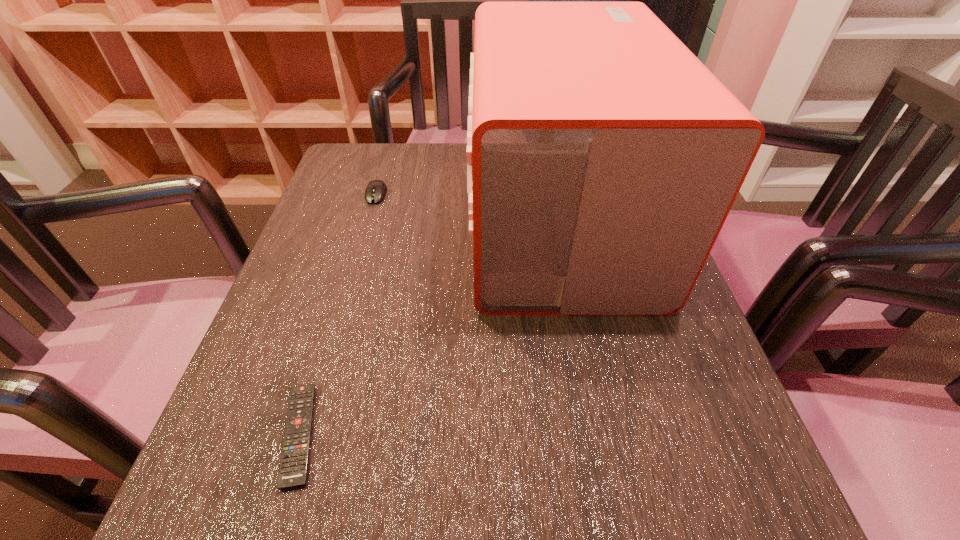
The height and width of the screenshot is (540, 960). I want to click on box that is at the far edge, so pos(603,157).

Locate an element on the screen. computer mouse present at the far edge is located at coordinates (376, 190).

Find the location of a particular element. object present at the near edge is located at coordinates (293, 467).

Image resolution: width=960 pixels, height=540 pixels. I want to click on computer mouse present at the left edge, so click(376, 190).

At what (x,y) coordinates should I click in order to perform the action: click on remote control situated at the left edge. Please return your answer as a coordinate pair (x, y). Looking at the image, I should click on (293, 467).

Identify the location of object that is at the right edge. (603, 157).

The height and width of the screenshot is (540, 960). I want to click on object located at the far left corner, so click(x=376, y=190).

You are a GUI agent. You are given a task and a screenshot of the screen. Output one action in this format:
    pyautogui.click(x=<x>, y=<y>)
    Task: Click on the object that is at the near left corner
    The image size is (960, 540).
    Given the screenshot: What is the action you would take?
    pyautogui.click(x=293, y=467)

The height and width of the screenshot is (540, 960). Find the location of `object positioned at the far right corner`. object positioned at the far right corner is located at coordinates (603, 157).

This screenshot has width=960, height=540. I want to click on vacant space at the far edge, so click(x=426, y=164).